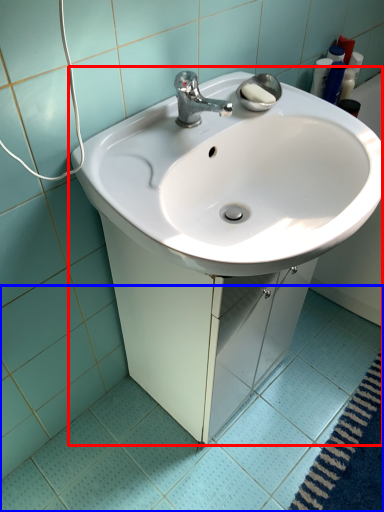
Question: Which of the following is the farthest to the observer, sink (highlighted by a red box) or ceramic tile (highlighted by a blue box)?

Choices:
 (A) sink
 (B) ceramic tile

Answer: (B)